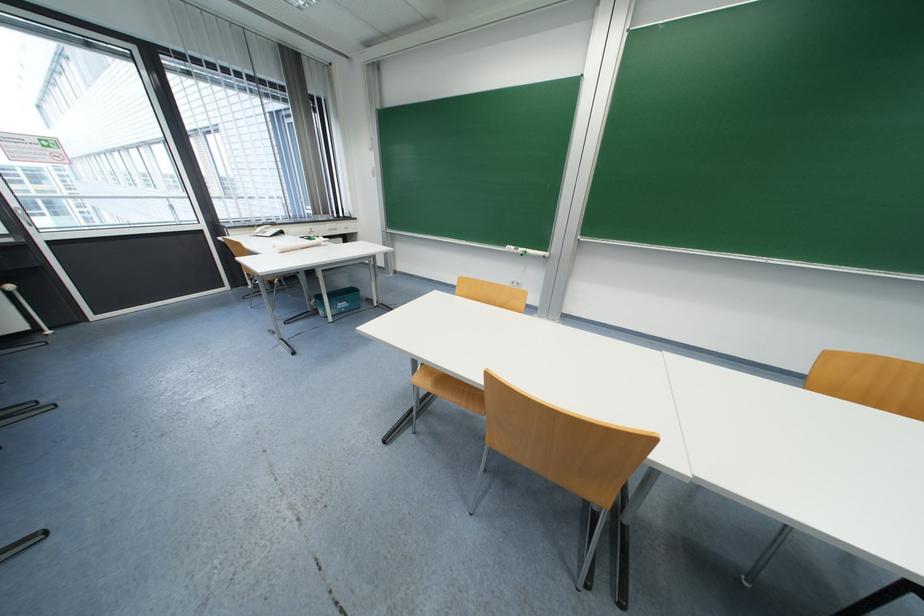
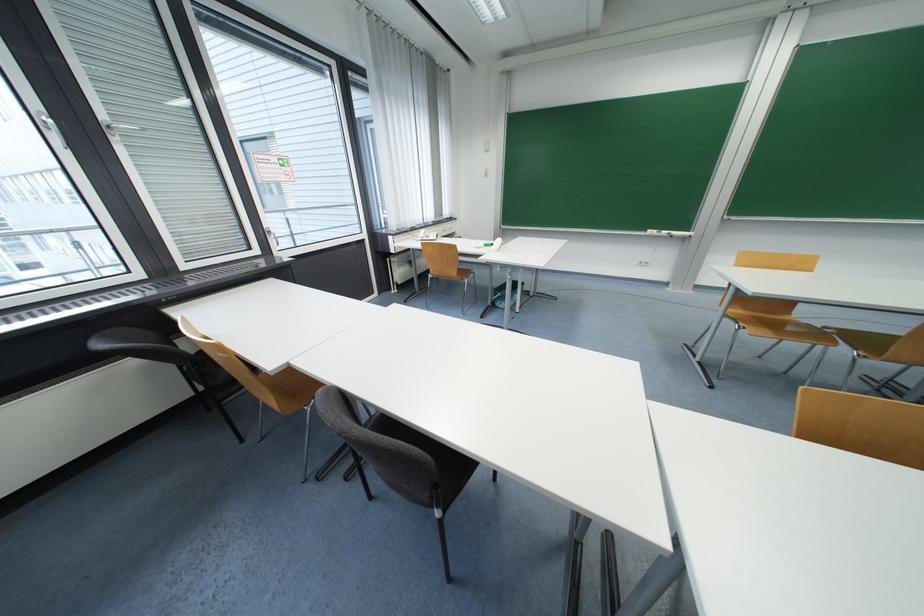
Question: Which direction would the cameraman need to move to produce the second image? Reply with the corresponding letter.

Choices:
 (A) Left
 (B) Right
 (C) Forward
 (D) Backward

Answer: (A)